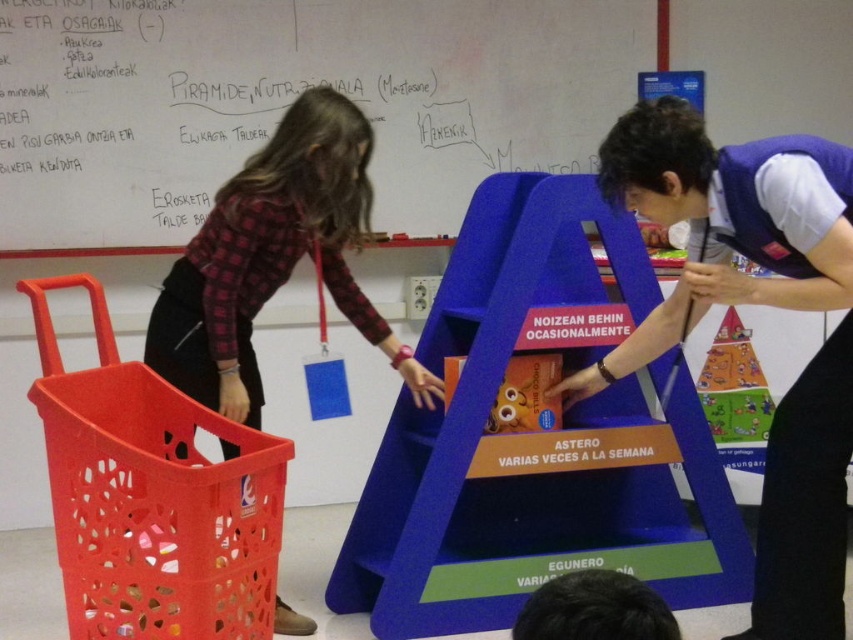
Does matte blue pyramid at center have a greater height compared to orange plastic basket at left?

Correct, matte blue pyramid at center is much taller as orange plastic basket at left.

Is matte blue pyramid at center to the left of orange plastic basket at left from the viewer's perspective?

Incorrect, matte blue pyramid at center is not on the left side of orange plastic basket at left.

Does point (614, 150) come farther from viewer compared to point (125, 580)?

Yes, point (614, 150) is behind point (125, 580).

You are a GUI agent. You are given a task and a screenshot of the screen. Output one action in this format:
    pyautogui.click(x=<x>, y=<y>)
    Task: Click on the matte blue pyramid at center
    The image size is (853, 640).
    Given the screenshot: What is the action you would take?
    pyautogui.click(x=759, y=305)

Does whiteboard at upper center appear on the right side of plaid fabric shirt at center?

Correct, you'll find whiteboard at upper center to the right of plaid fabric shirt at center.

Is whiteboard at upper center below plaid fabric shirt at center?

No.

This screenshot has height=640, width=853. I want to click on whiteboard at upper center, so click(291, 100).

The height and width of the screenshot is (640, 853). I want to click on whiteboard at upper center, so click(x=291, y=100).

Which is above, orange plastic basket at left or matte plastic toy at center?

Positioned higher is matte plastic toy at center.

Who is positioned more to the left, orange plastic basket at left or matte plastic toy at center?

Positioned to the left is orange plastic basket at left.

Where is `orange plastic basket at left`? The height and width of the screenshot is (640, 853). orange plastic basket at left is located at coordinates (151, 497).